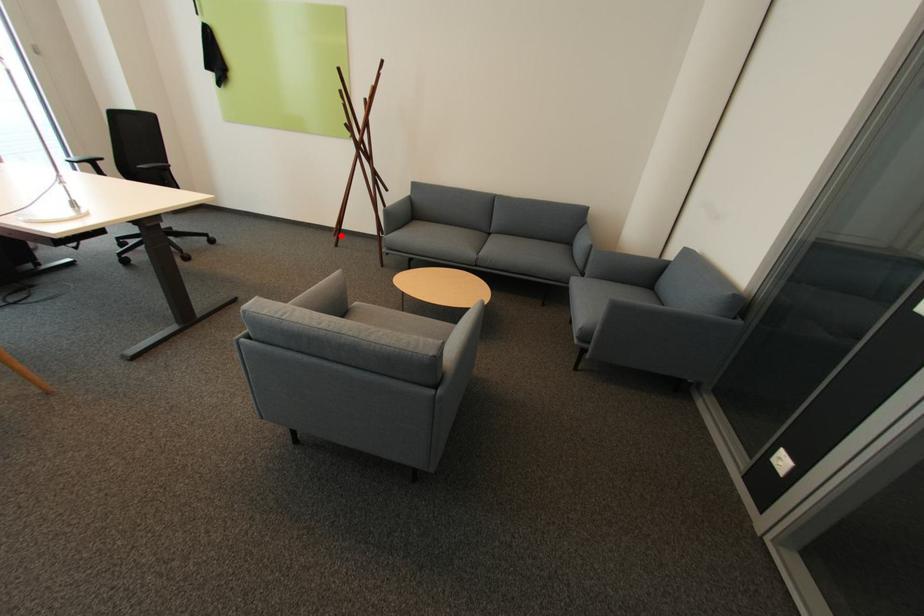
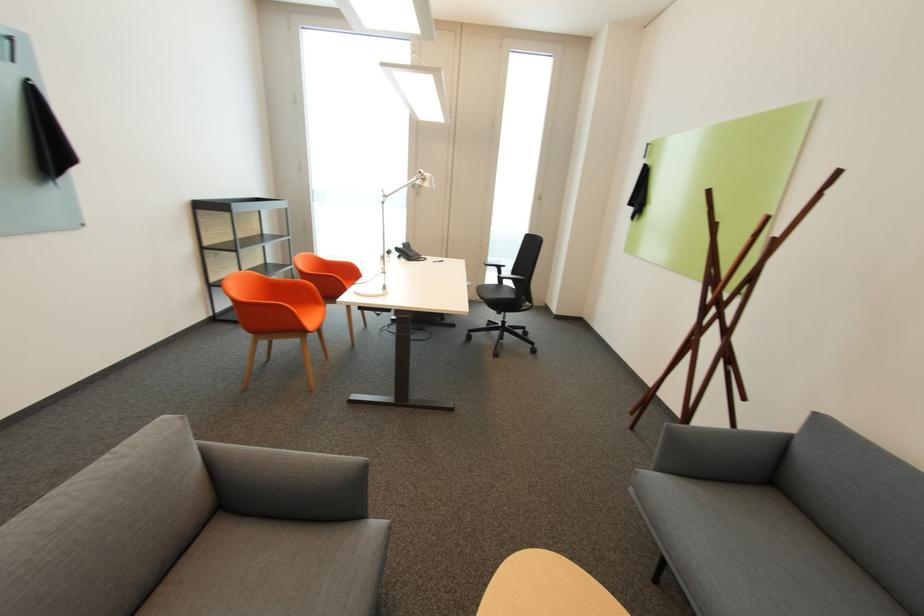
Where in the second image is the point corresponding to the highlighted location from the first image?

(638, 414)